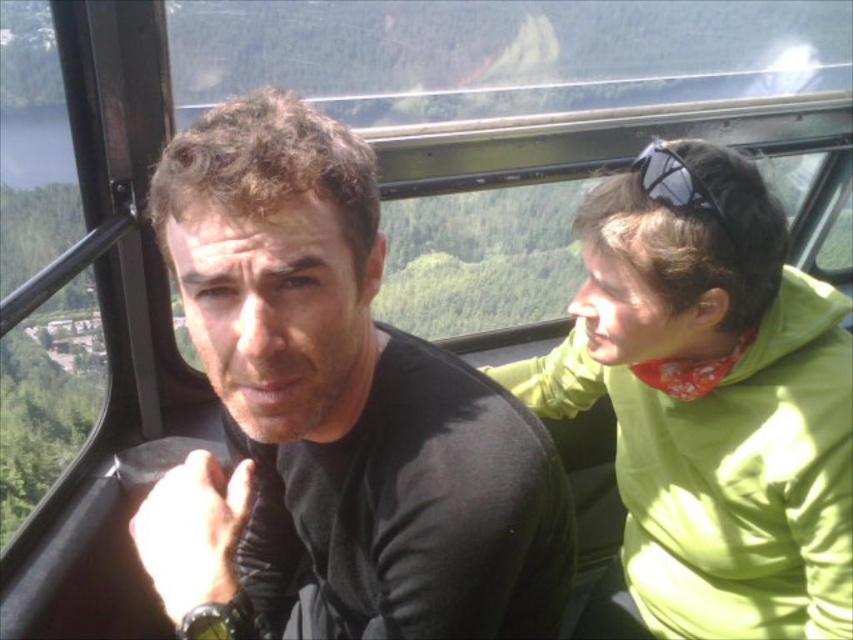
You are a tour guide standing 1.5 meters away from the camera. You want to hand a brochure to the person wearing the green fleece jacket at right. Can you reach them without moving closer?

The green fleece jacket at right is 1.27 meters away from the camera. Since you are 1.5 meters away from the camera, the distance between you and the green fleece jacket at right is 0.23 meters. Therefore, you can easily reach them without moving closer.

You are a photographer inside the cable car and want to capture a photo of the black matte shirt at center and the black matte sunglasses at upper right. Can you fit both objects in the frame if your camera has a 1.5 meter wide field of view?

The black matte shirt at center might be wider than black matte sunglasses at upper right, but since the field of view is 1.5 meters, it depends on their actual widths. If the shirt is wider than 1.5 meters, they won

You are a photographer positioned at point A. You want to capture a photo of the black matte shirt at center. The photographer is at point A, which is located at coordinates 0.5, 0.5. The black matte shirt at center is located at point [334,413]. Is the black matte shirt at center positioned to the left or right of point A?

The black matte shirt at center is positioned to the right of point A since its x coordinate is higher than point A.